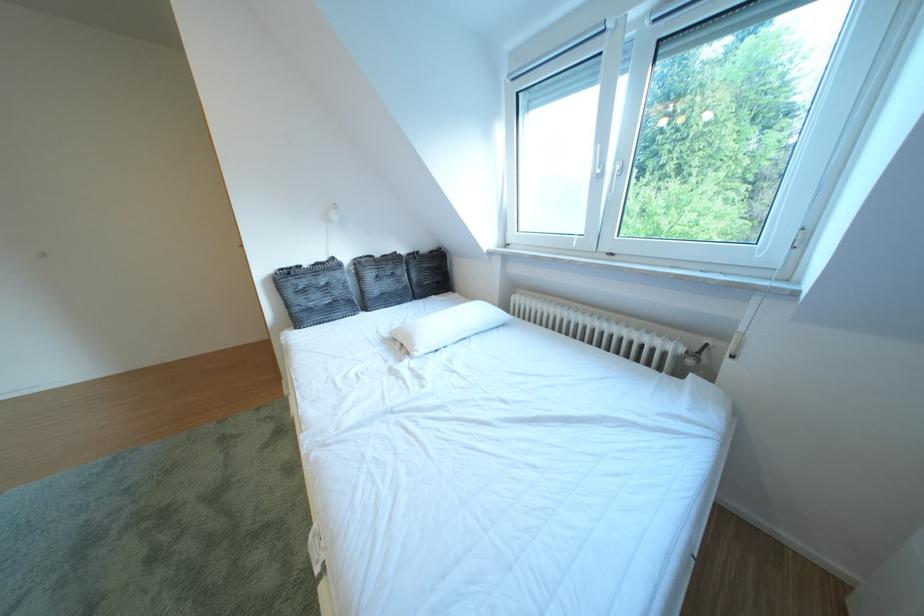
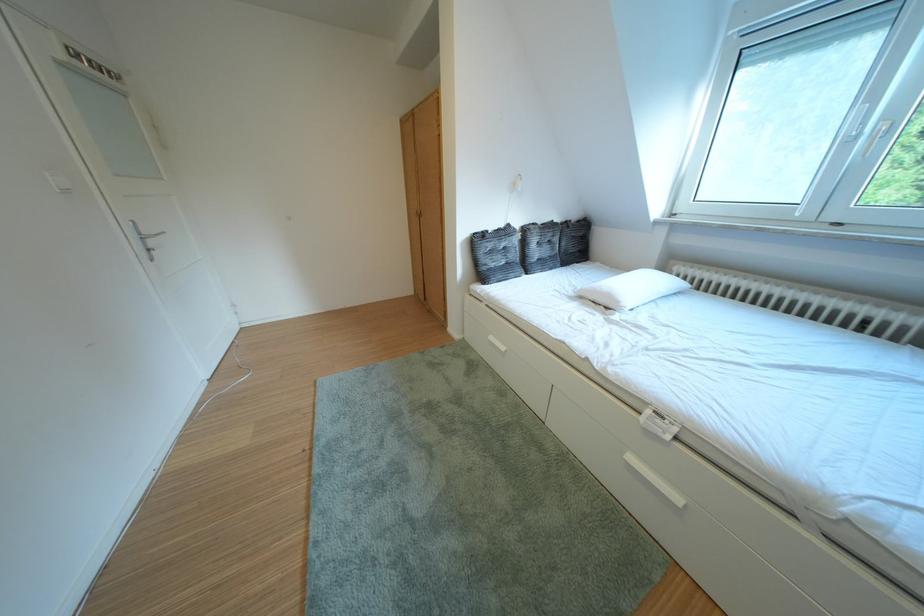
Find the pixel in the second image that matches pixel 439 253 in the first image.

(588, 222)